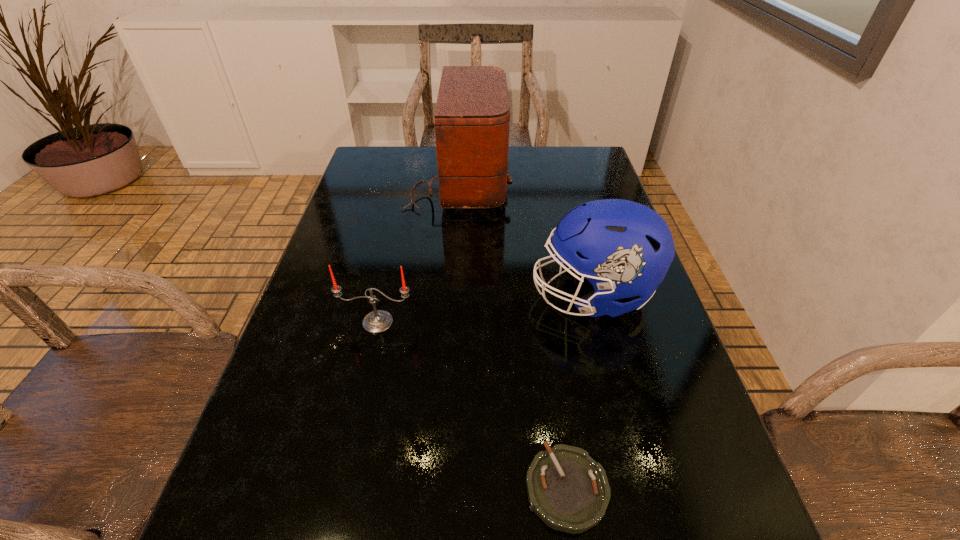
Image resolution: width=960 pixels, height=540 pixels. In the image, there is a desktop. Identify the location of vacant space at the far left corner. (362, 172).

This screenshot has width=960, height=540. In order to click on blank space at the far right corner of the desktop in this screenshot , I will do `click(581, 152)`.

Where is `free space between the ashtray and the football helmet`? Image resolution: width=960 pixels, height=540 pixels. free space between the ashtray and the football helmet is located at coordinates (579, 392).

The height and width of the screenshot is (540, 960). I want to click on vacant space in between the tallest object and the candle, so click(418, 252).

You are a GUI agent. You are given a task and a screenshot of the screen. Output one action in this format:
    pyautogui.click(x=<x>, y=<y>)
    Task: Click on the empty space between the tallest object and the football helmet
    
    Given the screenshot: What is the action you would take?
    pyautogui.click(x=525, y=238)

Locate an element on the screen. free space between the nearest object and the tallest object is located at coordinates (513, 334).

The image size is (960, 540). Find the location of `vacant space in between the football helmet and the ashtray`. vacant space in between the football helmet and the ashtray is located at coordinates (579, 392).

This screenshot has height=540, width=960. In order to click on free space between the football helmet and the second shortest object in this screenshot , I will do `click(485, 308)`.

The image size is (960, 540). Identify the location of free space between the ashtray and the candle. (472, 405).

The image size is (960, 540). Identify the location of vacant space that is in between the farthest object and the second tallest object. (525, 238).